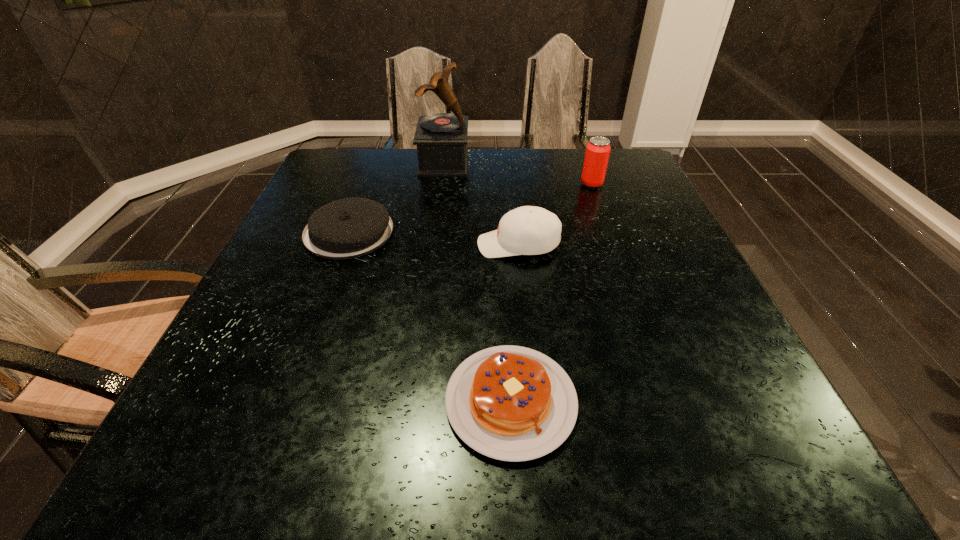
The height and width of the screenshot is (540, 960). Identify the location of vacant area that satisfies the following two spatial constraints: 1. at the horn opening of the rightmost object; 2. on the left side of the farthest object. (442, 184).

Find the location of a particular element. free space that satisfies the following two spatial constraints: 1. at the horn opening of the tallest object; 2. on the left side of the nearest object is located at coordinates (414, 401).

I want to click on vacant position in the image that satisfies the following two spatial constraints: 1. on the front-facing side of the baseball cap; 2. on the front side of the nearer pancake, so click(535, 401).

This screenshot has height=540, width=960. What are the coordinates of `vacant space that satisfies the following two spatial constraints: 1. at the horn opening of the farthest object; 2. on the right side of the beer can` in the screenshot? It's located at (442, 184).